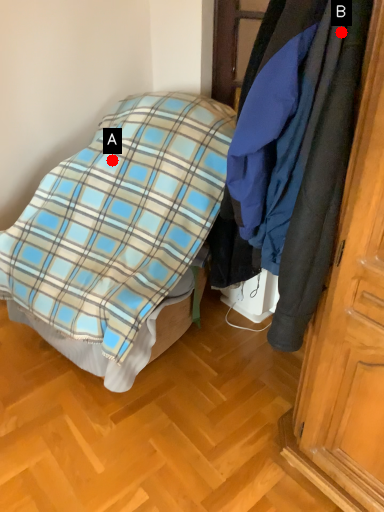
Question: Two points are circled on the image, labeled by A and B beside each circle. Which point is closer to the camera?

Choices:
 (A) A is closer
 (B) B is closer

Answer: (B)